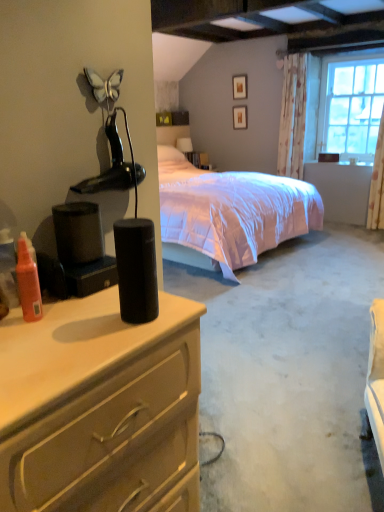
Where is `vacant area that is in front of translucent orange spray bottle at left`? The image size is (384, 512). vacant area that is in front of translucent orange spray bottle at left is located at coordinates (32, 346).